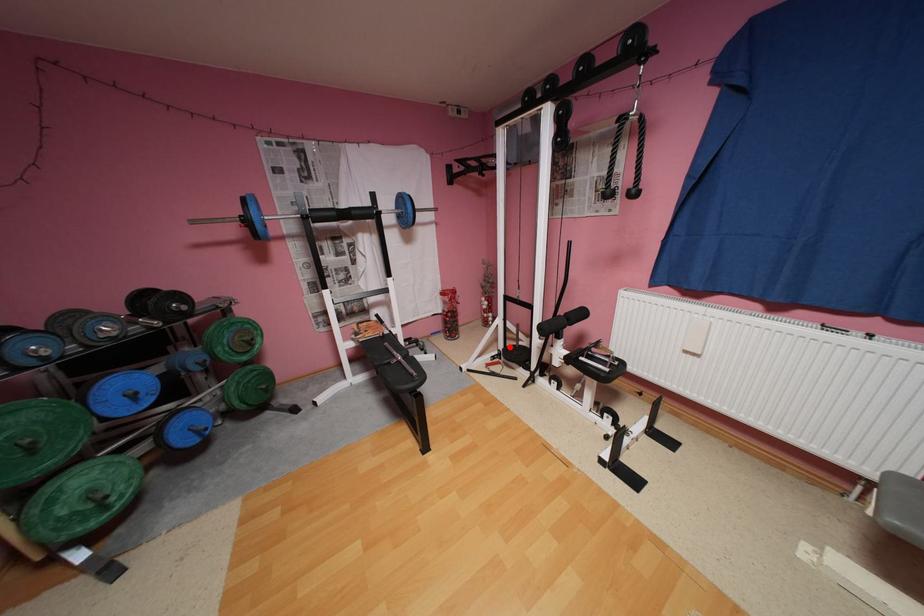
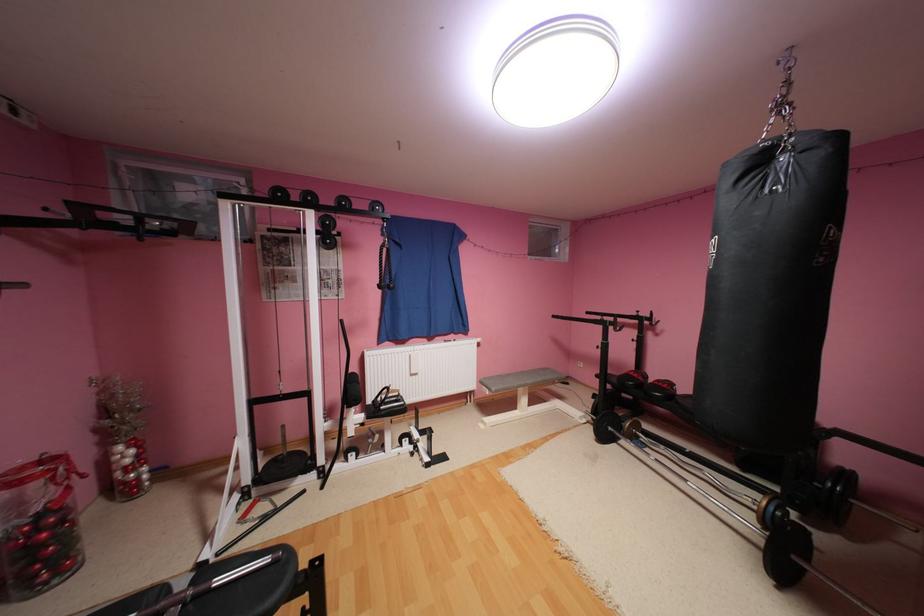
Question: I am providing you with two images of the same scene from different viewpoints. Given a red point in image1, look at the same physical point in image2. Is it:

Choices:
 (A) Closer to the viewpoint
 (B) Farther from the viewpoint

Answer: (A)